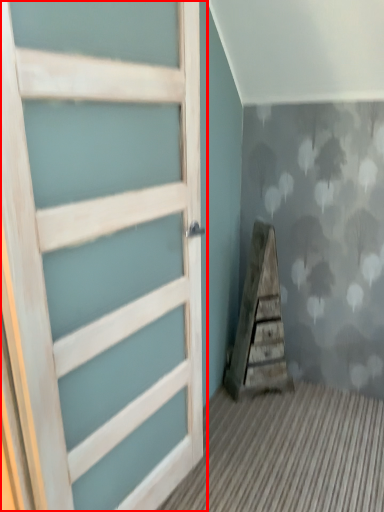
Question: From the image's perspective, where is door (annotated by the red box) located in relation to stairwell in the image?

Choices:
 (A) below
 (B) above

Answer: (B)